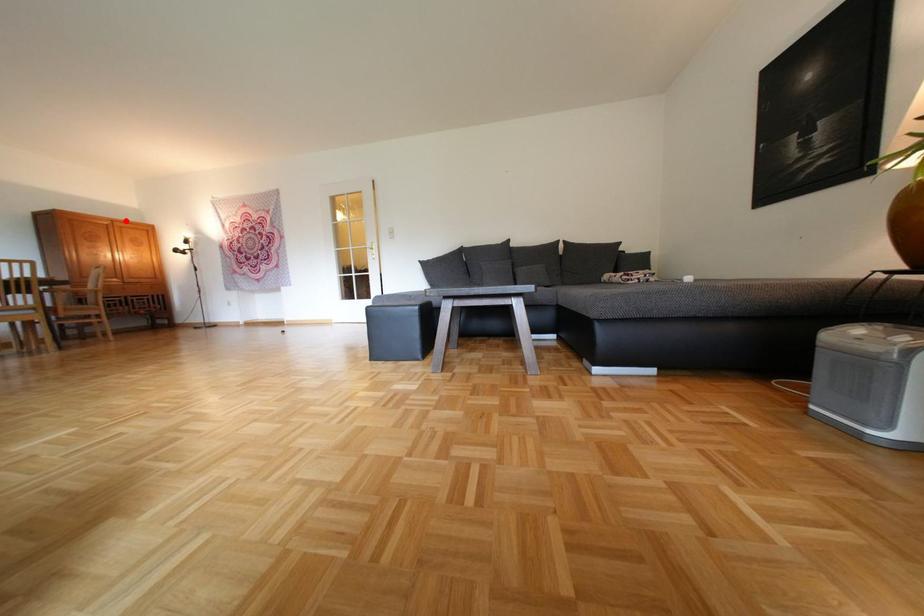
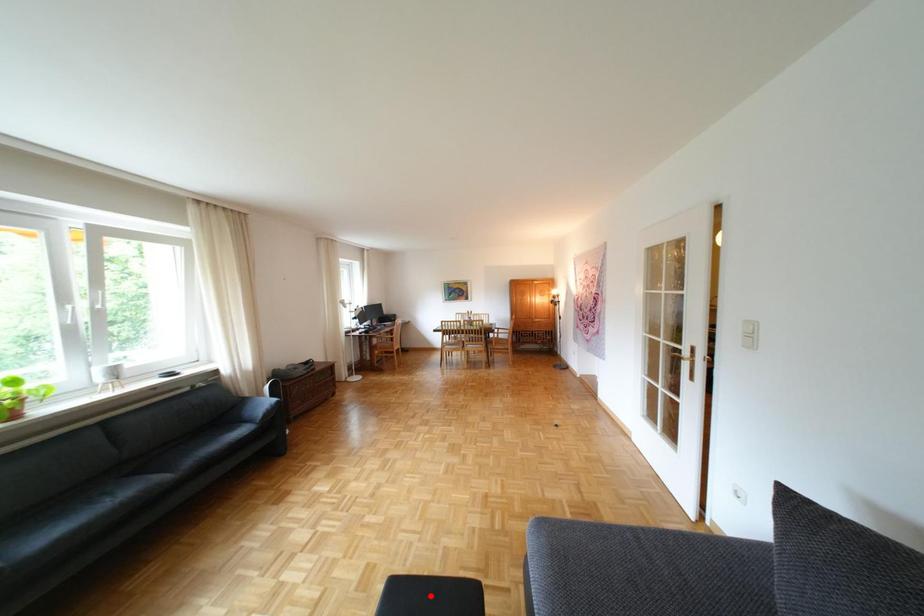
I am providing you with two images of the same scene from different viewpoints. A red point is marked on the first image and another point is marked on the second image. Is the marked point in image1 the same physical position as the marked point in image2?

No